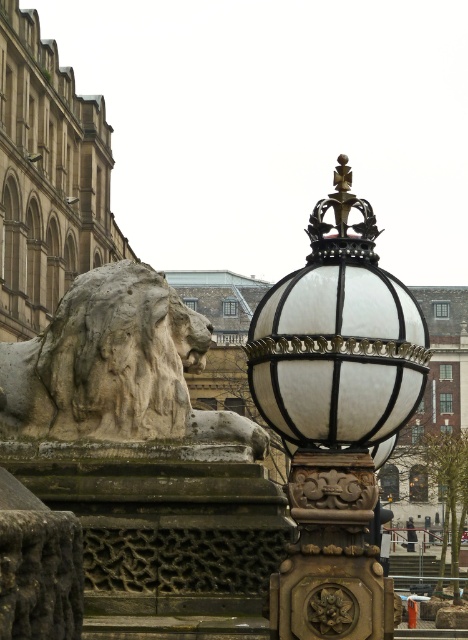
Question: Can you confirm if white glass lamp post at center is positioned below stone lion at left?

Choices:
 (A) no
 (B) yes

Answer: (B)

Question: Which of the following is the farthest from the observer?

Choices:
 (A) white glass lamp post at center
 (B) stone lion at left

Answer: (B)

Question: Is white glass lamp post at center bigger than stone lion at left?

Choices:
 (A) yes
 (B) no

Answer: (A)

Question: Which point is farther from the camera taking this photo?

Choices:
 (A) (52, 324)
 (B) (368, 348)

Answer: (A)

Question: Is white glass lamp post at center wider than stone lion at left?

Choices:
 (A) no
 (B) yes

Answer: (A)